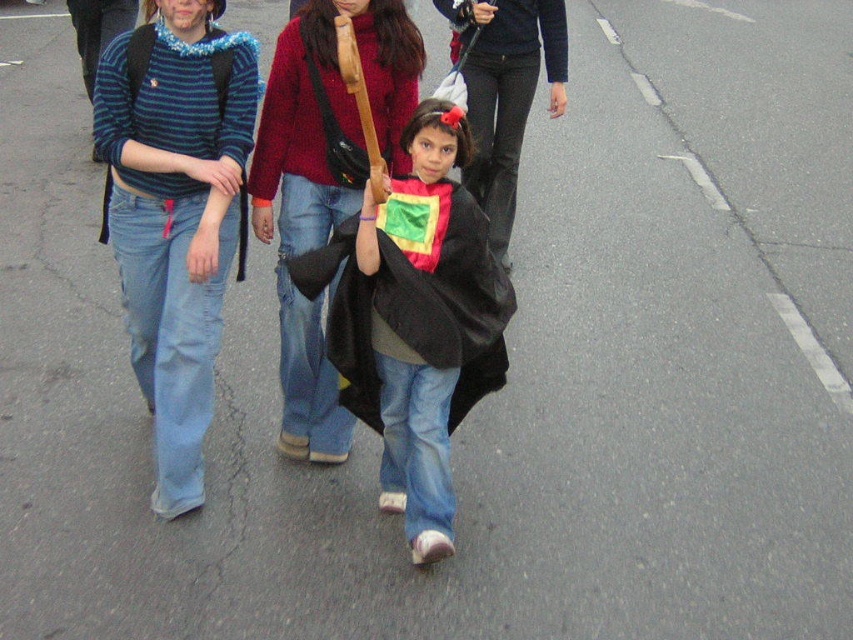
Question: Which object is the closest to the matte red sweater at center?

Choices:
 (A) matte black cape at center
 (B) striped knit sweater at left
 (C) velvet black cape at center

Answer: (B)

Question: Which of the following is the closest to the observer?

Choices:
 (A) (202, 234)
 (B) (321, 177)
 (C) (494, 52)

Answer: (A)

Question: Which point is closer to the camera taking this photo?

Choices:
 (A) (277, 113)
 (B) (485, 128)

Answer: (A)

Question: Considering the relative positions of matte red sweater at center and matte black cape at center in the image provided, where is matte red sweater at center located with respect to matte black cape at center?

Choices:
 (A) above
 (B) below

Answer: (B)

Question: Can you confirm if striped knit sweater at left is bigger than matte red sweater at center?

Choices:
 (A) no
 (B) yes

Answer: (B)

Question: Considering the relative positions of velvet black cape at center and matte black cape at center in the image provided, where is velvet black cape at center located with respect to matte black cape at center?

Choices:
 (A) above
 (B) below

Answer: (B)